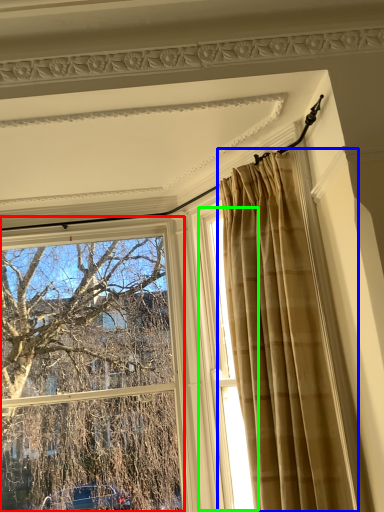
Question: Which is farther away from window (highlighted by a red box)? curtain (highlighted by a blue box) or window (highlighted by a green box)?

Choices:
 (A) curtain
 (B) window

Answer: (A)